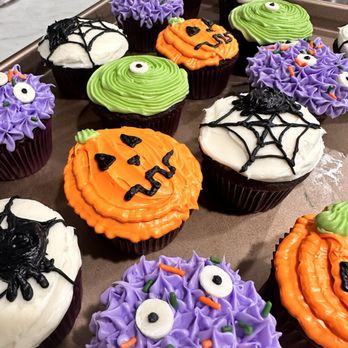
Locate an element on the screen. Image resolution: width=348 pixels, height=348 pixels. white tabletop is located at coordinates (26, 24).